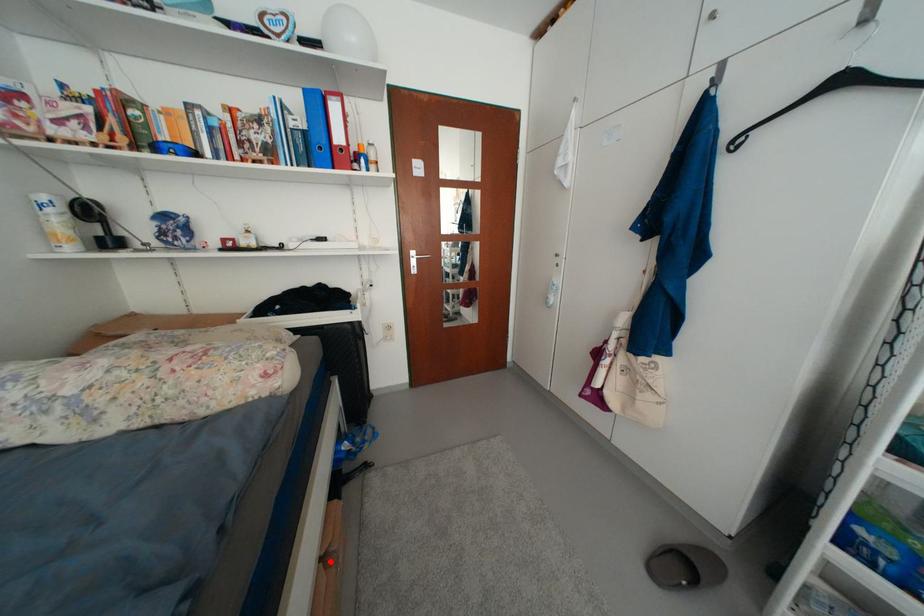
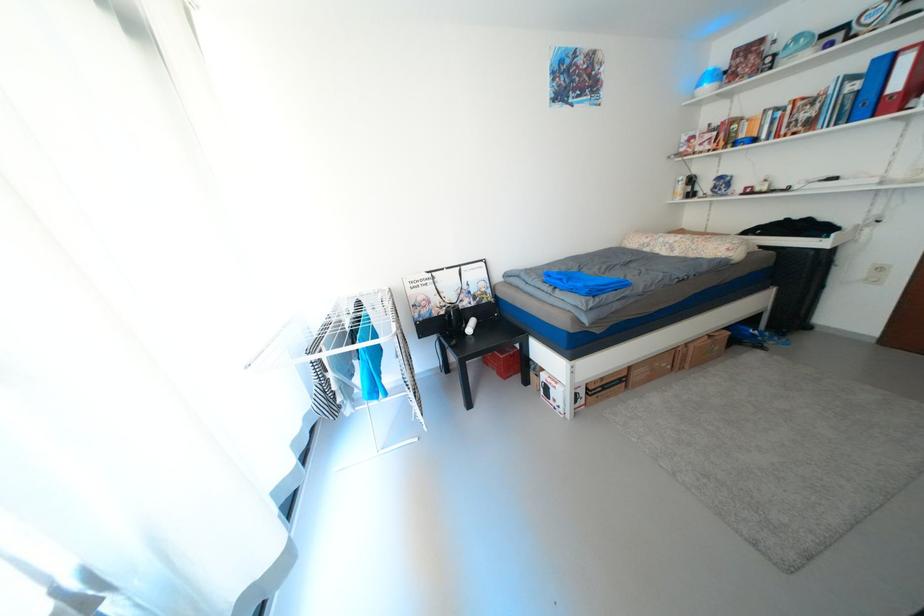
Locate, in the second image, the point that corresponds to the highlighted location in the first image.

(718, 338)